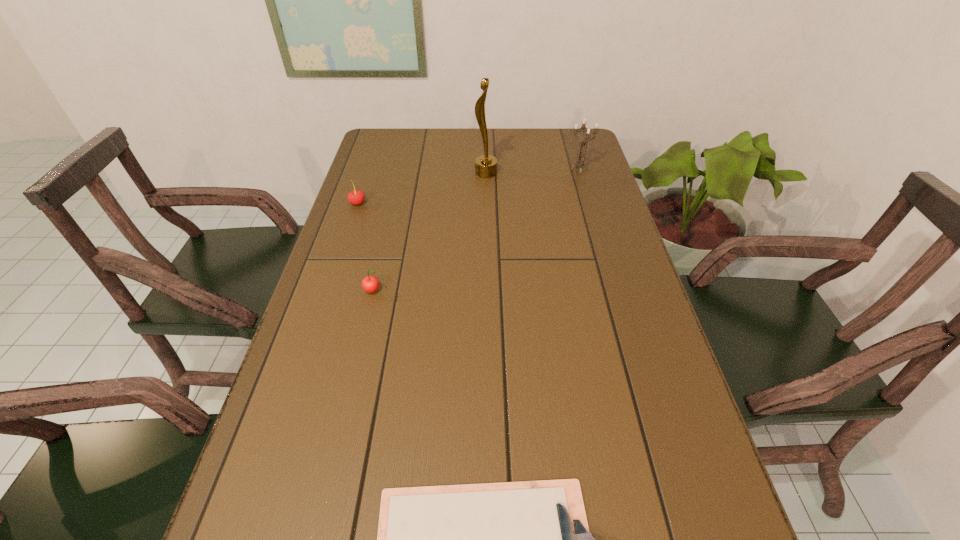
Where is `award`? The width and height of the screenshot is (960, 540). award is located at coordinates (486, 165).

Identify the location of the rightmost object. The width and height of the screenshot is (960, 540). (580, 162).

Find the location of `the second tallest object`. the second tallest object is located at coordinates (580, 162).

Locate an element on the screen. This screenshot has height=540, width=960. the left cherry is located at coordinates (356, 197).

This screenshot has width=960, height=540. In order to click on the farther cherry in this screenshot , I will do `click(356, 197)`.

This screenshot has width=960, height=540. What are the coordinates of `the second object from left to right` in the screenshot? It's located at (370, 284).

The height and width of the screenshot is (540, 960). Find the location of `the second nearest object`. the second nearest object is located at coordinates (370, 284).

Where is `free region located 0.210m on the front-facing side of the tallest object`? This screenshot has height=540, width=960. free region located 0.210m on the front-facing side of the tallest object is located at coordinates (413, 173).

At what (x,y) coordinates should I click in order to perform the action: click on vacant space located on the front-facing side of the tallest object. Please return your answer as a coordinate pair (x, y). This screenshot has height=540, width=960. Looking at the image, I should click on [421, 173].

At what (x,y) coordinates should I click in order to perform the action: click on free space located 0.380m on the front-facing side of the tallest object. Please return your answer as a coordinate pair (x, y). Image resolution: width=960 pixels, height=540 pixels. Looking at the image, I should click on (362, 173).